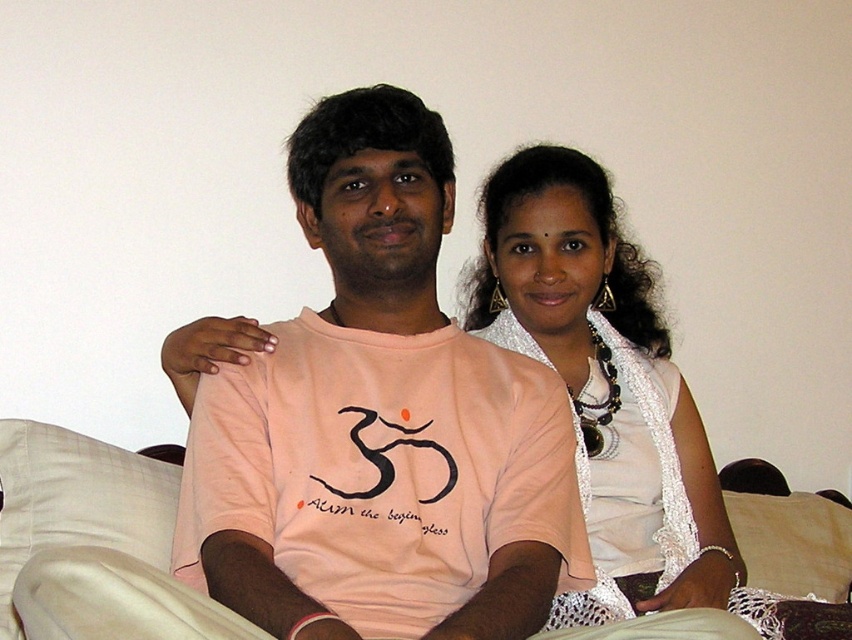
Question: Is pink cotton t-shirt at center positioned in front of beige fabric pillow at lower right?

Choices:
 (A) yes
 (B) no

Answer: (A)

Question: Is pink cotton t-shirt at center to the left of beige fabric pillow at lower right from the viewer's perspective?

Choices:
 (A) no
 (B) yes

Answer: (B)

Question: Among these points, which one is nearest to the camera?

Choices:
 (A) (631, 284)
 (B) (847, 584)

Answer: (A)

Question: Where is white lace scarf at upper right located in relation to beige fabric pillow at lower right in the image?

Choices:
 (A) above
 (B) below

Answer: (A)

Question: Which of these objects is positioned farthest from the beige fabric pillow at lower right?

Choices:
 (A) white lace scarf at upper right
 (B) pink cotton t-shirt at center

Answer: (B)

Question: Which point appears closest to the camera in this image?

Choices:
 (A) (594, 232)
 (B) (448, 456)
 (C) (746, 532)

Answer: (B)